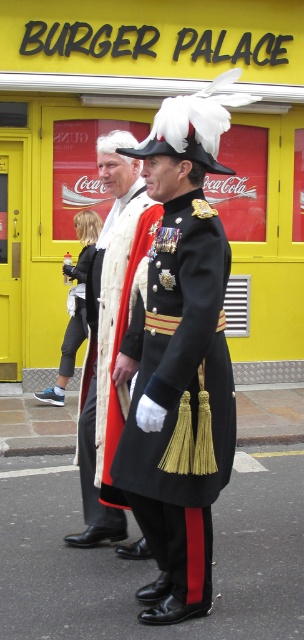
You are a fashion designer analyzing the image. You need to determine the exact position of the shiny black fabric coat at center. What are its coordinates?

The coordinates of the shiny black fabric coat at center are at point (180, 362).

You are a photographer trying to capture a clear photo of the white feathered hat at center and the matte black coat at center. Since you want to ensure both are visible, which object should you focus on first to avoid blurring due to their size difference?

The white feathered hat at center is shorter than the matte black coat at center, so you should focus on the matte black coat at center first as it is taller and might require more precise focusing to ensure clarity.

You are a photographer trying to capture a clear photo of the shiny black fabric coat at center and the matte white scarf at center. However, the lighting is tricky. Which object might be more challenging to photograph due to its reflective surface?

The shiny black fabric coat at center might be more challenging to photograph due to its reflective surface, as it is positioned in front of the matte white scarf at center.